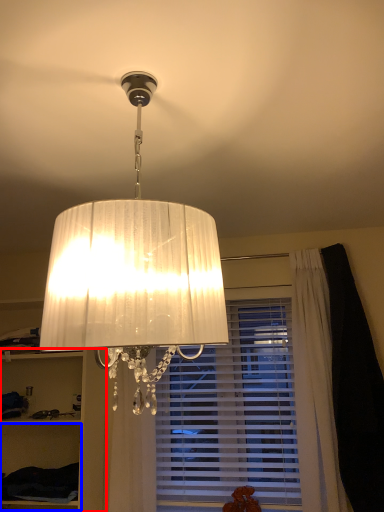
Question: Which object is closer to the camera taking this photo, cabinet (highlighted by a red box) or cabinet (highlighted by a blue box)?

Choices:
 (A) cabinet
 (B) cabinet

Answer: (A)